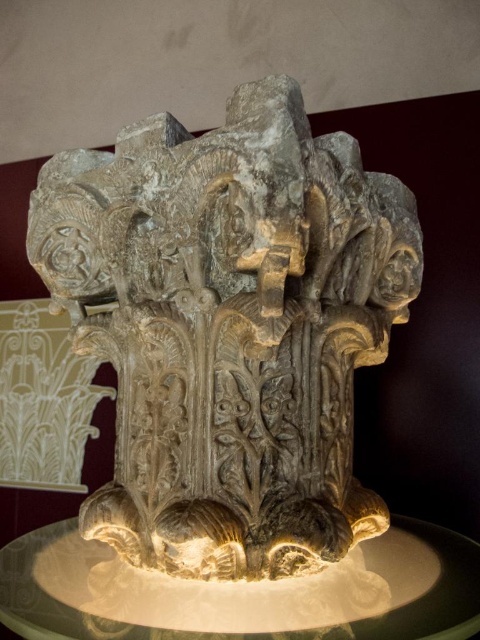
Question: Is carved stone sculpture at center bigger than satin gold pedestal at center?

Choices:
 (A) no
 (B) yes

Answer: (B)

Question: Among these objects, which one is nearest to the camera?

Choices:
 (A) satin gold pedestal at center
 (B) carved stone sculpture at center

Answer: (A)

Question: Can you confirm if carved stone sculpture at center is thinner than satin gold pedestal at center?

Choices:
 (A) yes
 (B) no

Answer: (A)

Question: Is carved stone sculpture at center to the right of satin gold pedestal at center from the viewer's perspective?

Choices:
 (A) yes
 (B) no

Answer: (A)